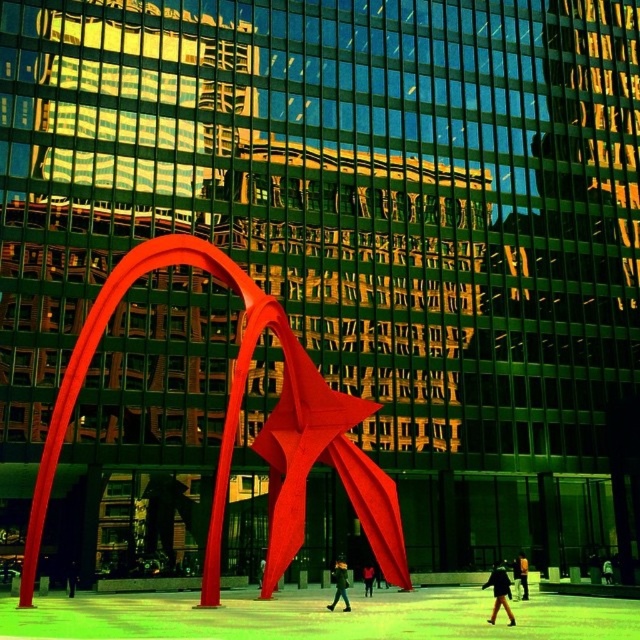
You are a fashion designer observing the urban scene. You notice the dark brown leather jacket at lower right and the dark green fabric jacket at center. Which jacket has a greater width?

The dark brown leather jacket at lower right has a greater width than the dark green fabric jacket at center.

You are standing in the urban scene with the large red sculpture. You see a black fabric person at center and a black leather jacket at lower center. Which object is wider?

The black fabric person at center is wider than the black leather jacket at lower center.